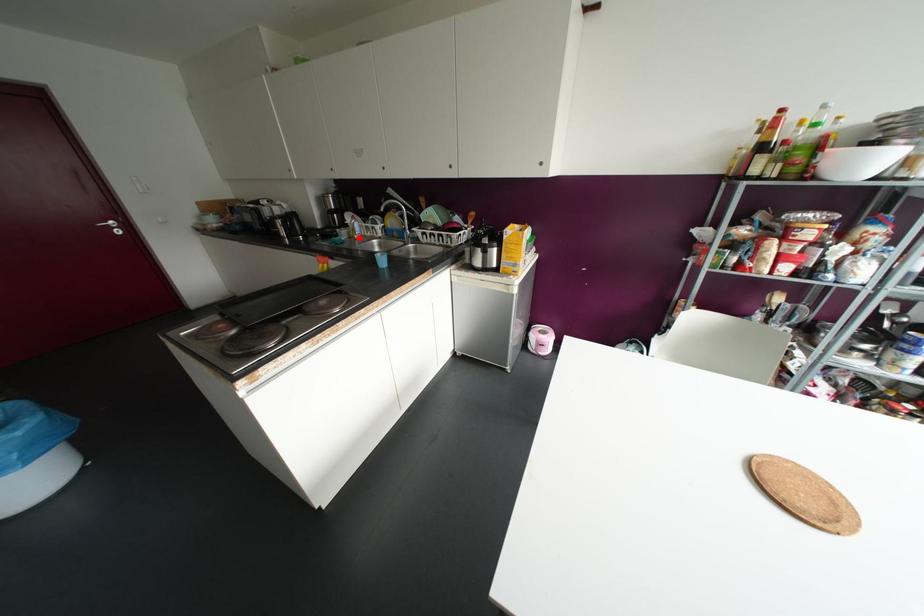
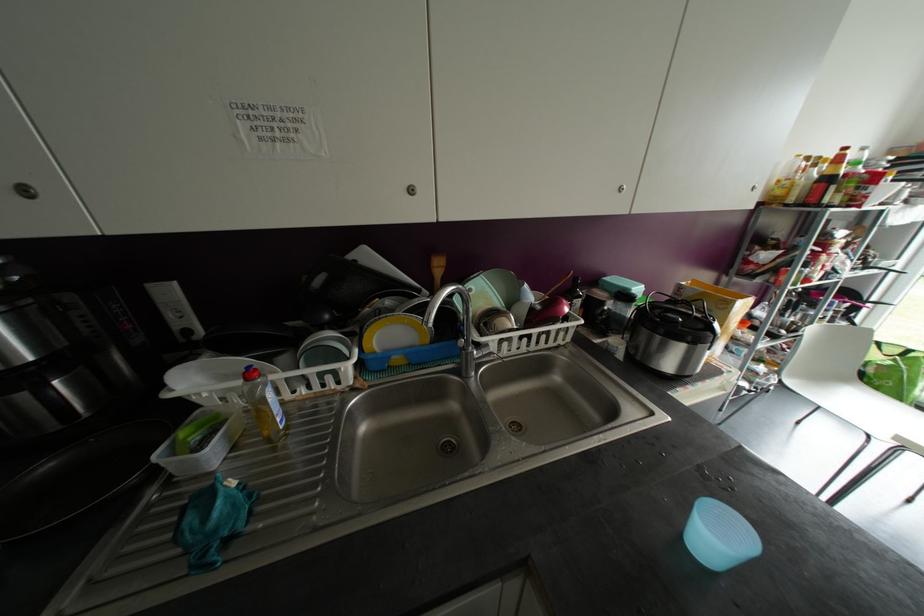
Question: A red point is marked in image1. In image2, is the corresponding 3D point closer to the camera or farther? Reply with the corresponding letter.

Choices:
 (A) The corresponding 3D point is closer.
 (B) The corresponding 3D point is farther.

Answer: (A)